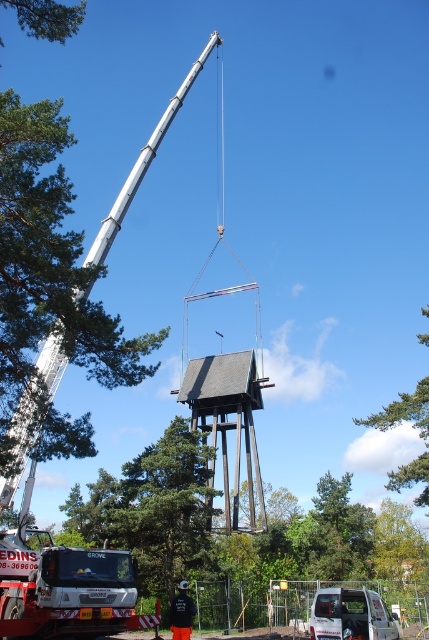
Please look at the image. There is a point marked at coordinates (398,545). The image shows a construction scene with a crane lifting a bell tower and a Grove truck in the foreground. Can you identify what object is located at that coordinate?

The point at coordinates (398,545) corresponds to a green leafy tree at center.

You are a construction worker standing at the origin point of the coordinate system. You need to move towards the gray wooden tower at center. Which direction should you move in based on its coordinates?

The gray wooden tower at center is located at coordinates point (229, 422), so you should move towards the right and slightly forward from your current position at the origin.

You are a crane operator trying to position the lifted bell tower between two green leafy trees. The trees are labeled as the green leafy tree at center and the green leafy tree at upper left. Which tree should you place the bell tower closer to if you want it to be near the larger tree?

The green leafy tree at center is bigger than the green leafy tree at upper left. Therefore, you should place the bell tower closer to the green leafy tree at center to be near the larger tree.